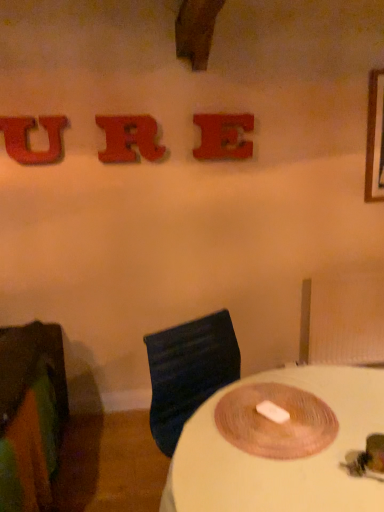
Question: Is glittery red letter u at upper left, which appears as the third alphabet when viewed from the right, oriented away from white matte table at center?

Choices:
 (A) no
 (B) yes

Answer: (A)

Question: Is glittery red letter u at upper left, which is the first alphabet in left-to-right order, taller than white matte table at center?

Choices:
 (A) no
 (B) yes

Answer: (A)

Question: Is white matte table at center located within glittery red letter u at upper left, which appears as the third alphabet when viewed from the right?

Choices:
 (A) yes
 (B) no

Answer: (B)

Question: Is the depth of glittery red letter u at upper left, which is the first alphabet in left-to-right order, greater than that of white matte table at center?

Choices:
 (A) no
 (B) yes

Answer: (B)

Question: Is glittery red letter u at upper left, which is the first alphabet in left-to-right order, in front of white matte table at center?

Choices:
 (A) yes
 (B) no

Answer: (B)

Question: Considering the relative positions of glittery red letter u at upper left, which is the first alphabet in left-to-right order, and white matte table at center in the image provided, is glittery red letter u at upper left, which is the first alphabet in left-to-right order, to the left of white matte table at center from the viewer's perspective?

Choices:
 (A) no
 (B) yes

Answer: (B)

Question: Does green fabric chair at left turn towards rubberized red letter r at upper center, which is counted as the 2th alphabet, starting from the left?

Choices:
 (A) yes
 (B) no

Answer: (B)

Question: Is green fabric chair at left looking in the opposite direction of rubberized red letter r at upper center, which is counted as the 2th alphabet, starting from the left?

Choices:
 (A) yes
 (B) no

Answer: (B)

Question: Is green fabric chair at left shorter than rubberized red letter r at upper center, which is counted as the 2th alphabet, starting from the left?

Choices:
 (A) no
 (B) yes

Answer: (A)

Question: From the image's perspective, is green fabric chair at left on top of rubberized red letter r at upper center, which appears as the 2th alphabet when viewed from the right?

Choices:
 (A) yes
 (B) no

Answer: (B)

Question: Would you consider green fabric chair at left to be distant from rubberized red letter r at upper center, which appears as the 2th alphabet when viewed from the right?

Choices:
 (A) yes
 (B) no

Answer: (A)

Question: Is green fabric chair at left with rubberized red letter r at upper center, which appears as the 2th alphabet when viewed from the right?

Choices:
 (A) yes
 (B) no

Answer: (B)

Question: Is rubberized red letter r at upper center, which appears as the 2th alphabet when viewed from the right, not inside matte red letter e at upper center, marked as the 1th alphabet in a right-to-left arrangement?

Choices:
 (A) yes
 (B) no

Answer: (A)